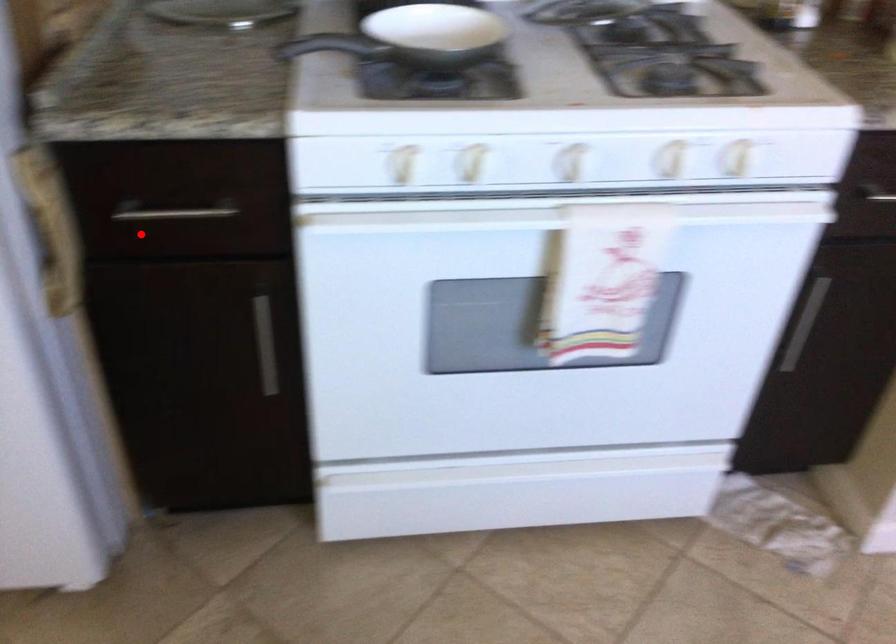
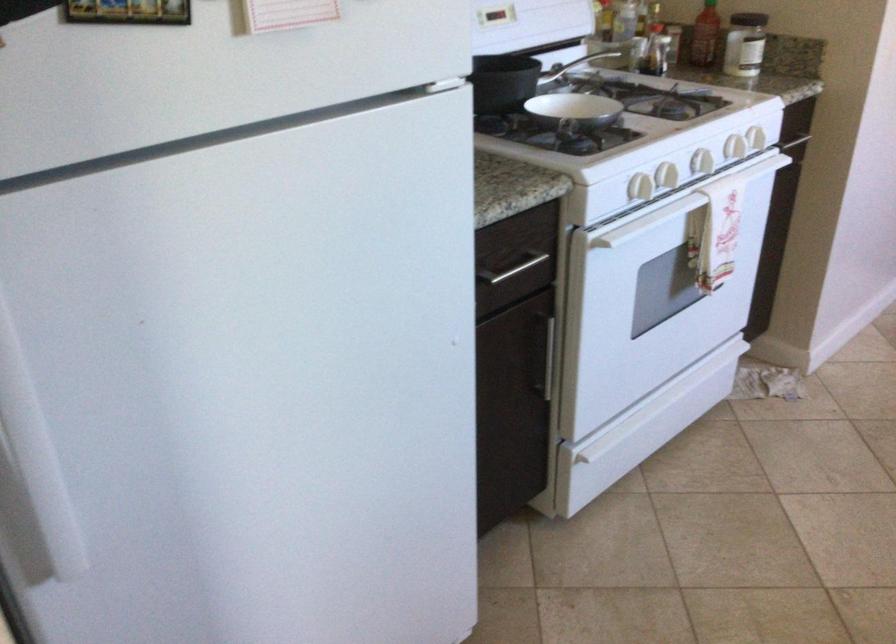
Locate, in the second image, the point that corresponds to the highlighted location in the first image.

(512, 268)